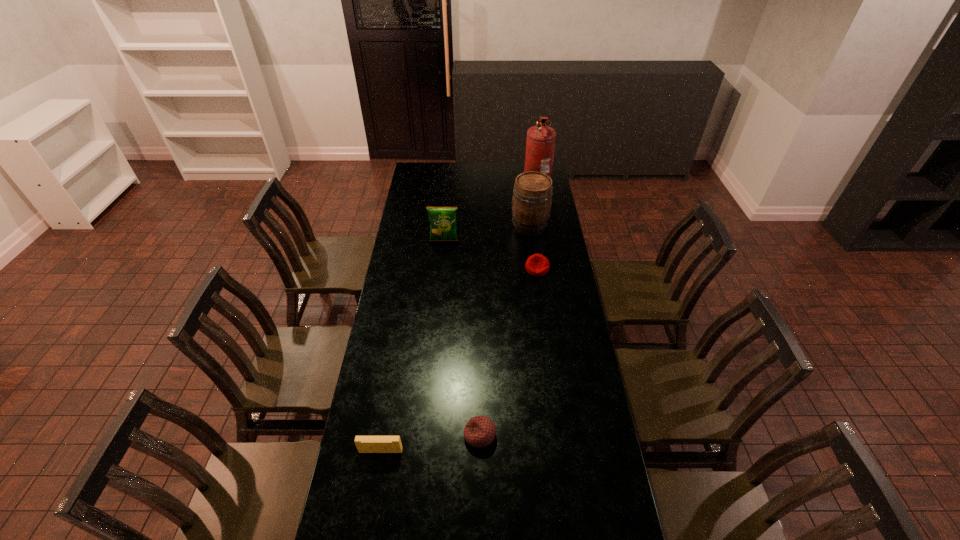
Find the location of a particular element. The width and height of the screenshot is (960, 540). the farthest object is located at coordinates (540, 143).

I want to click on the tallest object, so click(x=540, y=143).

Locate an element on the screen. The image size is (960, 540). the fifth shortest object is located at coordinates (531, 203).

I want to click on the third tallest object, so click(x=442, y=219).

Where is `the fifth object from right to left`? The image size is (960, 540). the fifth object from right to left is located at coordinates (442, 219).

The height and width of the screenshot is (540, 960). I want to click on the third shortest object, so click(x=365, y=444).

Locate an element on the screen. the leftmost object is located at coordinates (365, 444).

The width and height of the screenshot is (960, 540). What are the coordinates of `the fourth farthest object` in the screenshot? It's located at (537, 265).

In order to click on the farther beanbag in this screenshot , I will do `click(537, 265)`.

Locate an element on the screen. The height and width of the screenshot is (540, 960). the nearer beanbag is located at coordinates (479, 431).